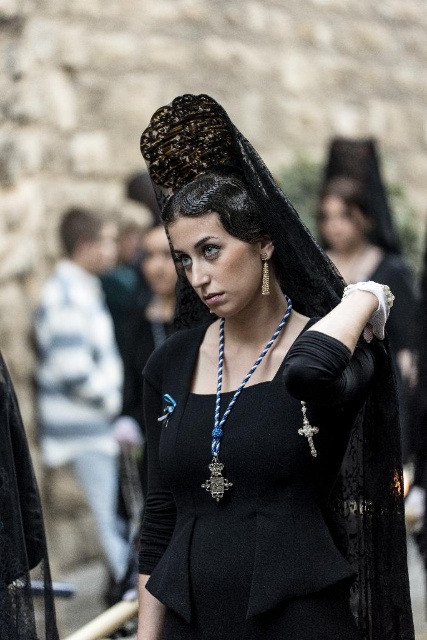
Who is positioned more to the left, black woolen dress at center or black velvet headdress at upper center?

black velvet headdress at upper center is more to the left.

Does point (195, 637) lie in front of point (184, 324)?

Yes.

At what (x,y) coordinates should I click in order to perform the action: click on black woolen dress at center. Please return your answer as a coordinate pair (x, y). Looking at the image, I should click on (249, 496).

Is black woolen dress at center above blue corded necklace at center?

Actually, black woolen dress at center is below blue corded necklace at center.

Does black woolen dress at center have a lesser height compared to blue corded necklace at center?

Incorrect, black woolen dress at center's height does not fall short of blue corded necklace at center's.

The width and height of the screenshot is (427, 640). What do you see at coordinates (249, 496) in the screenshot?
I see `black woolen dress at center` at bounding box center [249, 496].

Where is `black woolen dress at center`? The image size is (427, 640). black woolen dress at center is located at coordinates (249, 496).

Which is behind, point (157, 115) or point (207, 486)?

The point (157, 115) is more distant.

Locate an element on the screen. This screenshot has height=640, width=427. black velvet headdress at upper center is located at coordinates (245, 186).